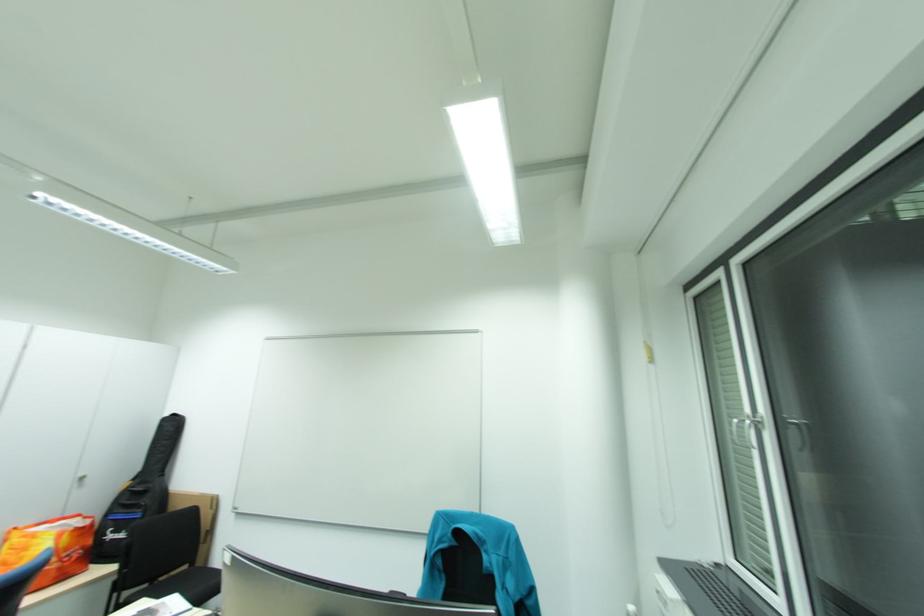
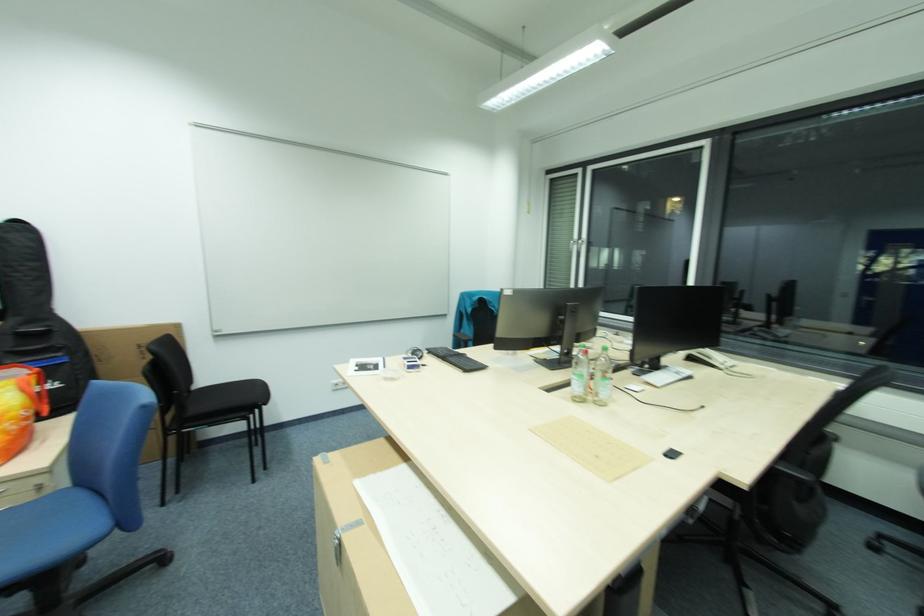
In the second image, find the point that corresponds to pixel 151 483 in the first image.

(41, 322)